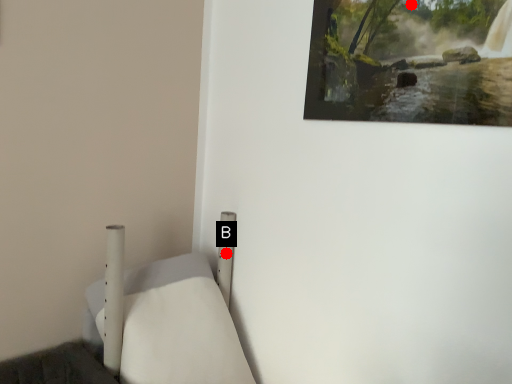
Question: Two points are circled on the image, labeled by A and B beside each circle. Which point is closer to the camera?

Choices:
 (A) A is closer
 (B) B is closer

Answer: (A)